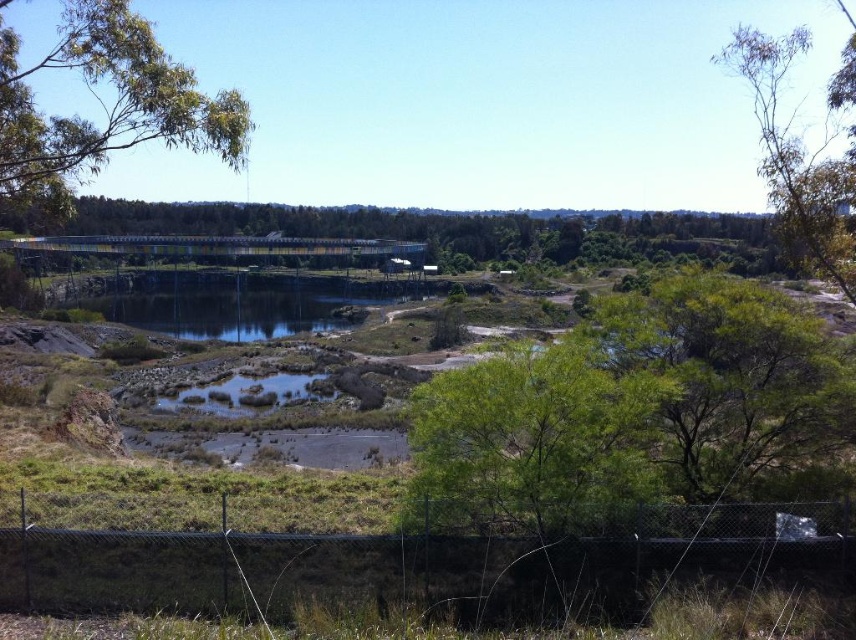
Between green leafy tree at lower right and green leafy tree at upper left, which one is positioned lower?

green leafy tree at lower right

Does point (528, 500) come in front of point (40, 189)?

Yes, point (528, 500) is closer to viewer.

The width and height of the screenshot is (856, 640). In order to click on green leafy tree at lower right in this screenshot , I will do `click(535, 444)`.

Is green leafy tree at center above green leafy tree at lower right?

Indeed, green leafy tree at center is positioned over green leafy tree at lower right.

Does green leafy tree at center have a lesser width compared to green leafy tree at lower right?

In fact, green leafy tree at center might be wider than green leafy tree at lower right.

Which is in front, point (635, 358) or point (635, 419)?

Positioned in front is point (635, 419).

At what (x,y) coordinates should I click in order to perform the action: click on green leafy tree at center. Please return your answer as a coordinate pair (x, y). Image resolution: width=856 pixels, height=640 pixels. Looking at the image, I should click on (635, 413).

Does green leafy tree at lower right have a greater width compared to clear water at center?

In fact, green leafy tree at lower right might be narrower than clear water at center.

The image size is (856, 640). What do you see at coordinates (535, 444) in the screenshot?
I see `green leafy tree at lower right` at bounding box center [535, 444].

Where is `green leafy tree at lower right`? The height and width of the screenshot is (640, 856). green leafy tree at lower right is located at coordinates (535, 444).